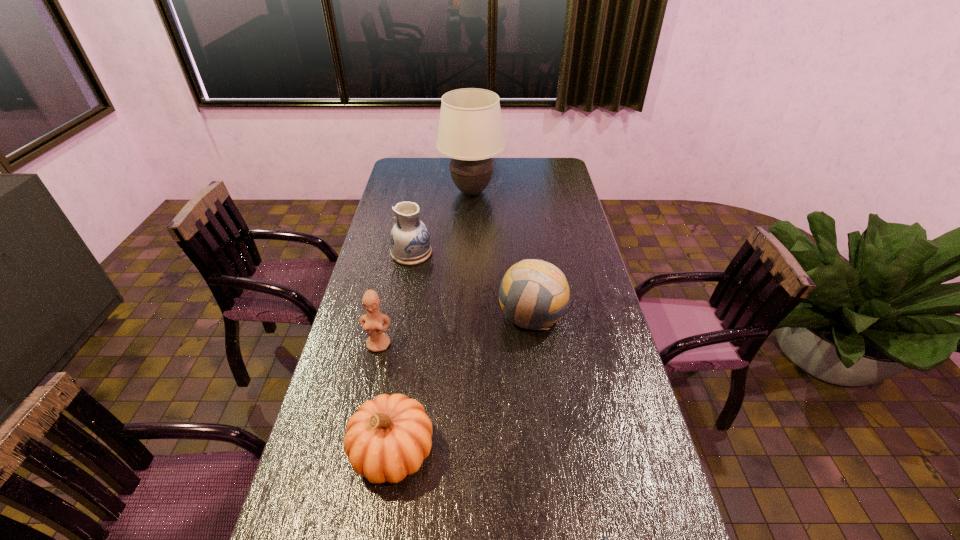
Locate an element on the screen. empty space between the pottery and the figurine is located at coordinates (396, 299).

In order to click on vacant space in between the figurine and the volleyball in this screenshot , I will do `click(455, 329)`.

Where is `empty space that is in between the pottery and the tallest object`? empty space that is in between the pottery and the tallest object is located at coordinates (442, 222).

Locate which object ranks second in proximity to the volleyball. Please provide its 2D coordinates. Your answer should be formatted as a tuple, i.e. [(x, y)], where the tuple contains the x and y coordinates of a point satisfying the conditions above.

[(388, 438)]

Locate which object ranks in proximity to the figurine. Please provide its 2D coordinates. Your answer should be formatted as a tuple, i.e. [(x, y)], where the tuple contains the x and y coordinates of a point satisfying the conditions above.

[(388, 438)]